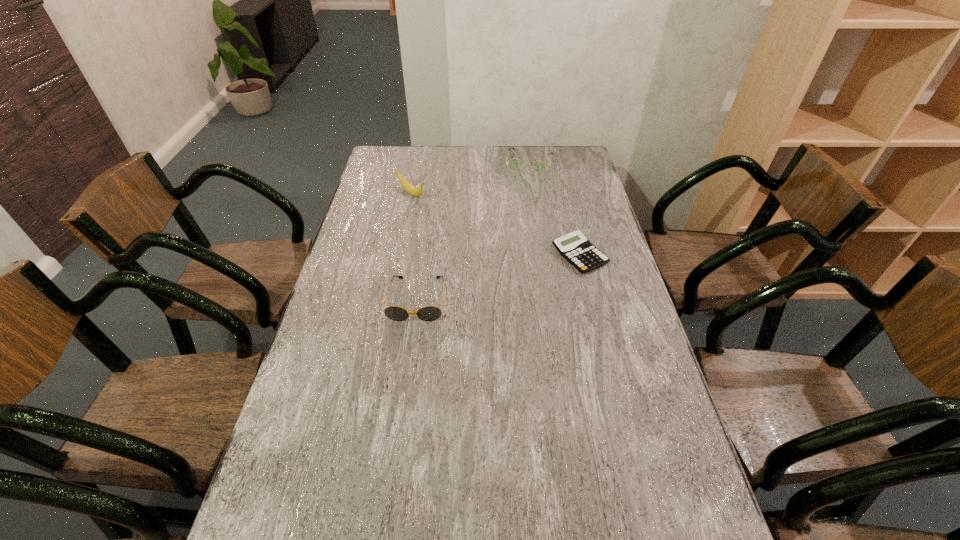
This screenshot has width=960, height=540. I want to click on sunglasses, so click(x=429, y=313).

This screenshot has height=540, width=960. Find the location of `the second nearest object`. the second nearest object is located at coordinates (574, 247).

In order to click on calculator in this screenshot , I will do (574, 247).

Find the location of a particular element. The image size is (960, 540). the tallest object is located at coordinates (411, 189).

Where is `the second farthest object`? The height and width of the screenshot is (540, 960). the second farthest object is located at coordinates (411, 189).

Find the location of a particular element. This screenshot has width=960, height=540. spectacles is located at coordinates (515, 165).

Image resolution: width=960 pixels, height=540 pixels. I want to click on free point located on the lenses of the nearest object, so click(406, 377).

Image resolution: width=960 pixels, height=540 pixels. In order to click on vacant space located on the back of the calculator in this screenshot , I will do `click(572, 225)`.

At what (x,y) coordinates should I click in order to perform the action: click on free space located at the stem of the banana. Please return your answer as a coordinate pair (x, y). Looking at the image, I should click on (448, 222).

The width and height of the screenshot is (960, 540). What are the coordinates of `vacant area situated at the stem of the banana` in the screenshot? It's located at (430, 209).